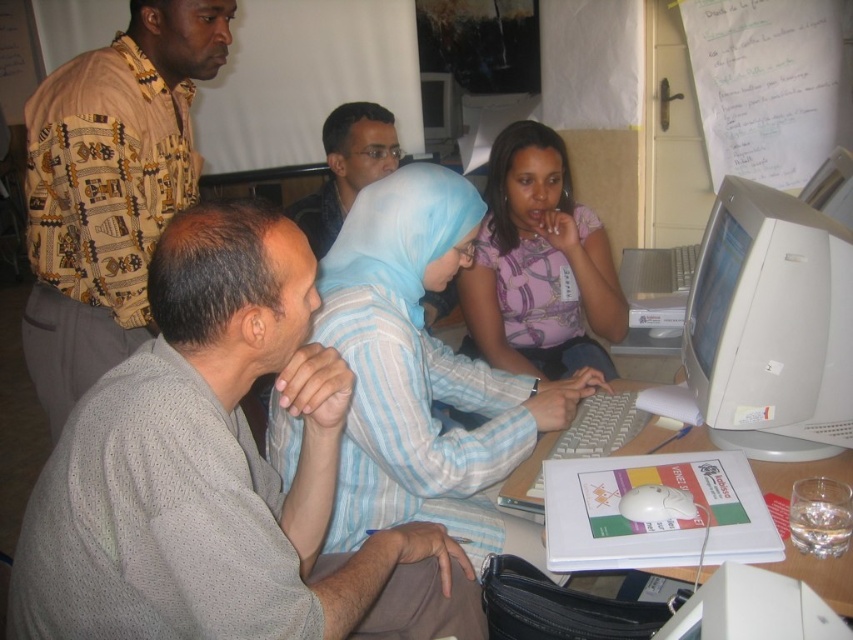
Question: Observing the image, what is the correct spatial positioning of light blue fabric hijab at center in reference to dark blue shirt at center?

Choices:
 (A) below
 (B) above

Answer: (A)

Question: Among these objects, which one is nearest to the camera?

Choices:
 (A) light blue fabric hijab at center
 (B) gray dotted shirt at lower left

Answer: (B)

Question: Which of the following is the farthest from the observer?

Choices:
 (A) white plastic monitor at right
 (B) light blue fabric hijab at center

Answer: (B)

Question: Can you confirm if printed fabric shirt at upper left is positioned above white plastic monitor at right?

Choices:
 (A) yes
 (B) no

Answer: (A)

Question: Which of the following is the farthest from the observer?

Choices:
 (A) (167, 12)
 (B) (552, 266)
 (C) (442, 116)

Answer: (C)

Question: Does light blue fabric hijab at center appear under white plastic table at center?

Choices:
 (A) no
 (B) yes

Answer: (A)